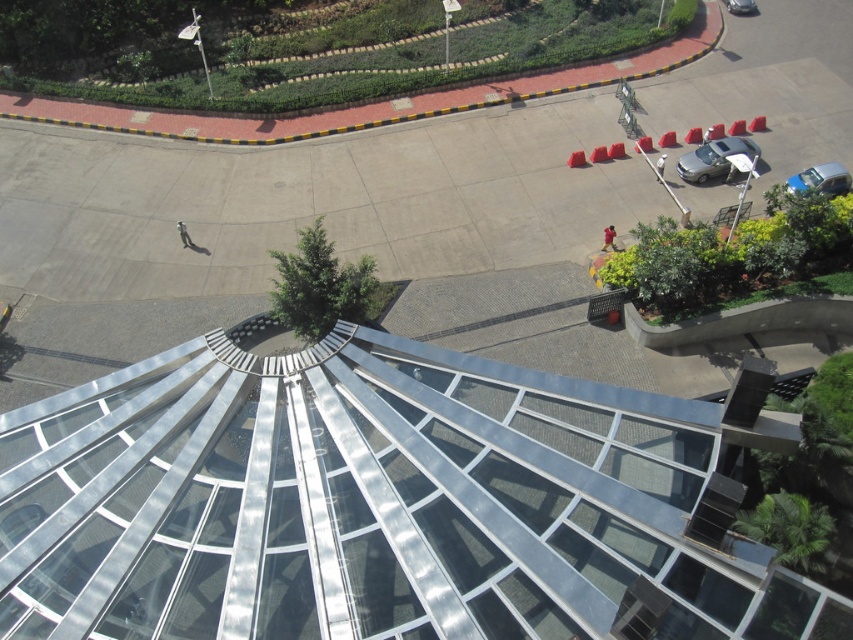
Question: Does metallic glass pyramid at center have a smaller size compared to blue metallic car at lower right?

Choices:
 (A) no
 (B) yes

Answer: (A)

Question: Which object is positioned closest to the blue metallic car at lower right?

Choices:
 (A) silver metallic car at upper right
 (B) satin silver sedan at right
 (C) metallic glass pyramid at center

Answer: (B)

Question: Which object appears farthest from the camera in this image?

Choices:
 (A) blue metallic car at lower right
 (B) silver metallic car at upper right
 (C) satin silver sedan at right

Answer: (B)

Question: Is metallic glass pyramid at center bigger than blue metallic car at lower right?

Choices:
 (A) yes
 (B) no

Answer: (A)

Question: Which of the following is the farthest from the observer?

Choices:
 (A) silver metallic car at upper right
 (B) metallic glass pyramid at center
 (C) satin silver sedan at right

Answer: (A)

Question: Can you confirm if metallic glass pyramid at center is positioned to the left of satin silver sedan at right?

Choices:
 (A) yes
 (B) no

Answer: (A)